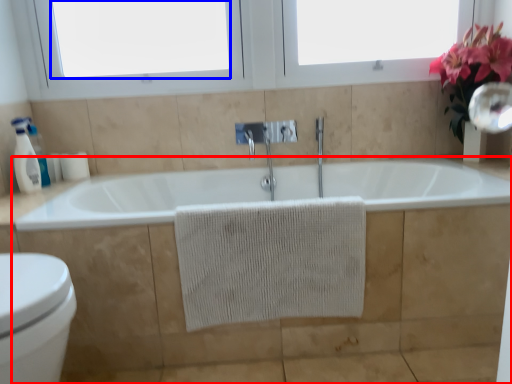
Question: Which object is further to the camera taking this photo, bath (highlighted by a red box) or window screen (highlighted by a blue box)?

Choices:
 (A) bath
 (B) window screen

Answer: (B)